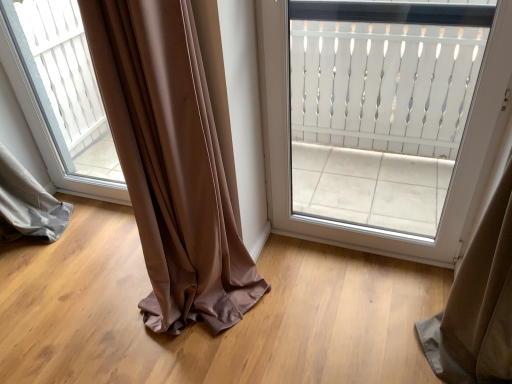
Question: In terms of size, does white textured door at upper center appear bigger or smaller than transparent glass window at center?

Choices:
 (A) small
 (B) big

Answer: (B)

Question: In the image, is white textured door at upper center on the left side or the right side of transparent glass window at center?

Choices:
 (A) left
 (B) right

Answer: (B)

Question: Relative to transparent glass window at center, is white textured door at upper center in front or behind?

Choices:
 (A) front
 (B) behind

Answer: (A)

Question: Considering the positions of point (31, 125) and point (274, 18), is point (31, 125) closer or farther from the camera than point (274, 18)?

Choices:
 (A) closer
 (B) farther

Answer: (B)

Question: Is transparent glass window at center bigger or smaller than white textured door at upper center?

Choices:
 (A) small
 (B) big

Answer: (A)

Question: Do you think transparent glass window at center is within white textured door at upper center, or outside of it?

Choices:
 (A) outside
 (B) inside

Answer: (A)

Question: Would you say transparent glass window at center is to the left or to the right of white textured door at upper center in the picture?

Choices:
 (A) right
 (B) left

Answer: (B)